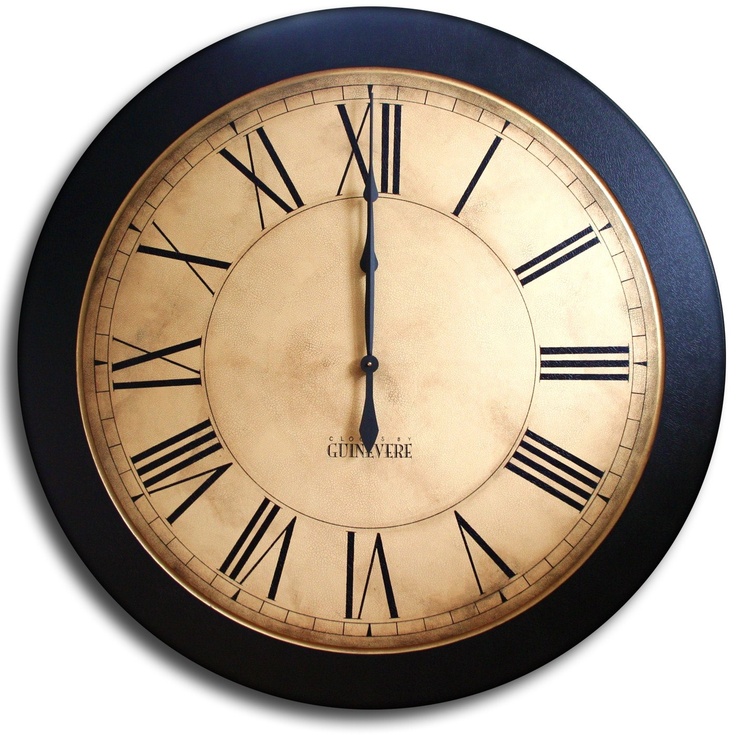
I want to click on clock border, so click(x=363, y=37).